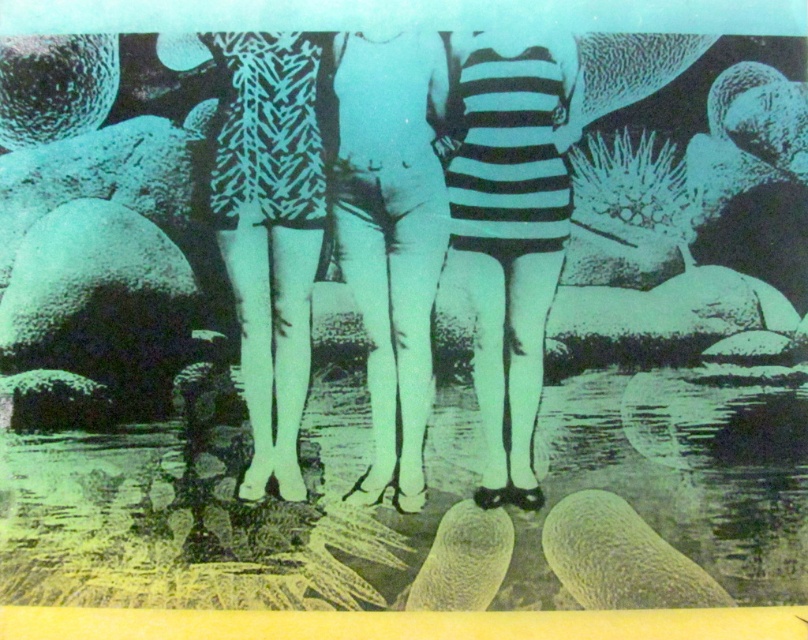
Question: Which object is farther from the camera taking this photo?

Choices:
 (A) striped fabric dress at center
 (B) white matte swimsuit at center

Answer: (B)

Question: Can you confirm if striped fabric dress at center is positioned to the right of white matte swimsuit at center?

Choices:
 (A) yes
 (B) no

Answer: (A)

Question: Is striped fabric dress at center below white matte swimsuit at center?

Choices:
 (A) yes
 (B) no

Answer: (A)

Question: Does striped fabric dress at center appear over white matte swimsuit at center?

Choices:
 (A) no
 (B) yes

Answer: (A)